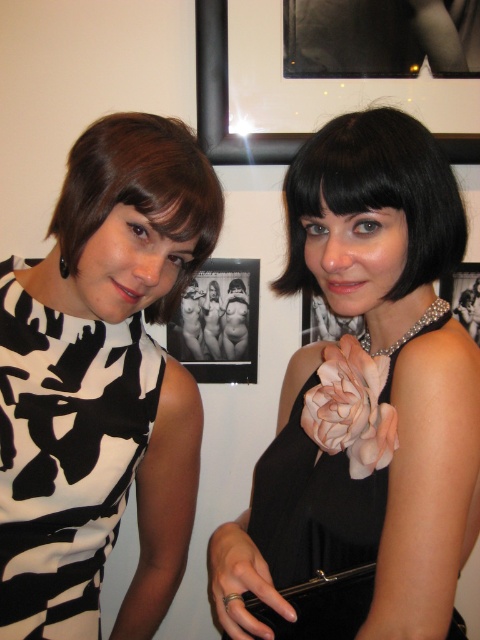
You are a photographer at an event and need to capture a photo of the two people. The camera you are using has a maximum width capacity of 1.2 meters. Given that the black satin dress at right and the metallic silver frame at upper center are in the background, will the camera be able to capture both objects within the frame without cropping?

The black satin dress at right has a larger width than the metallic silver frame at upper center. Since the camera has a maximum width capacity of 1.2 meters, but the exact widths of the objects are not provided, it is uncertain whether both will fit. However, if the combined width of both objects exceeds 1.2 meters, they might not fit. Without specific measurements, we cannot confirm for sure.

You are a photographer setting up for an event. You need to position a spotlight at point 0.8, 0.6 to highlight the black satin dress at right. Will the spotlight be positioned correctly to illuminate the dress?

The black satin dress at right is located at point (314, 531), so the spotlight at (288, 512) is very close but slightly to the left and below the dress. It might not fully illuminate the dress unless adjusted slightly to the right and upwards.